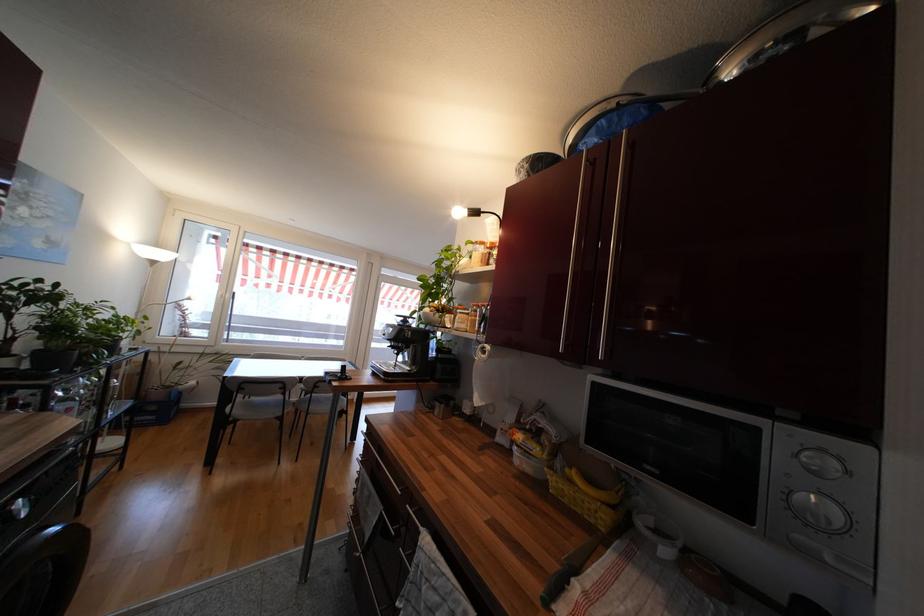
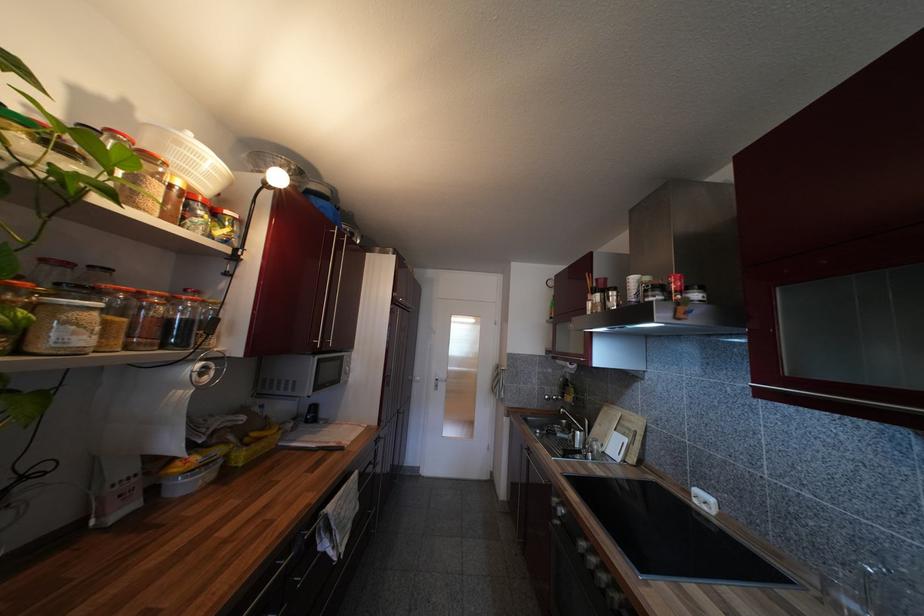
Where in the second image is the point corresponding to point (505, 431) from the first image?

(124, 498)